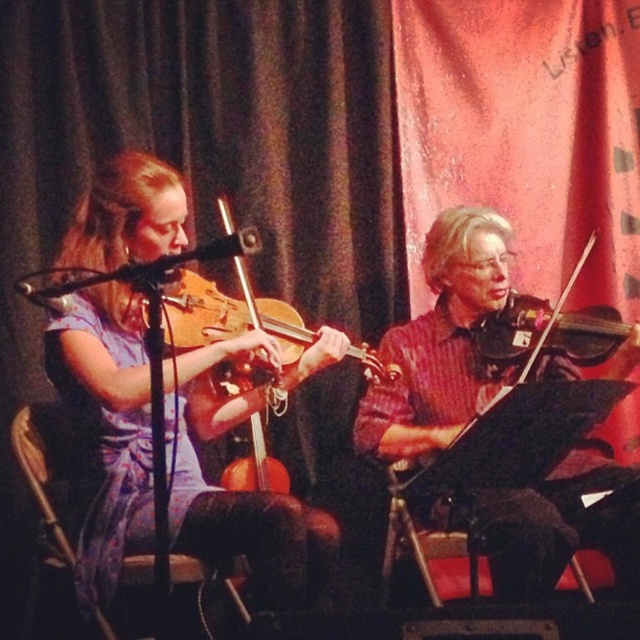
The image size is (640, 640). I want to click on matte black violin at center, so click(x=442, y=342).

Which is in front, point (502, 481) or point (177, 336)?

Positioned in front is point (177, 336).

Between point (480, 280) and point (230, 488), which one is positioned behind?

The point (230, 488) is more distant.

The image size is (640, 640). I want to click on matte black violin at center, so click(442, 342).

This screenshot has width=640, height=640. What do you see at coordinates (248, 492) in the screenshot?
I see `matte wood violin at left` at bounding box center [248, 492].

Is matte wood violin at left bigger than wooden violin at left?

No, matte wood violin at left is not bigger than wooden violin at left.

What are the coordinates of `matte wood violin at left` in the screenshot? It's located at (248, 492).

Who is more distant from viewer, (109,362) or (445,262)?

The point (445,262) is behind.

Is matte wood violin at left to the right of matte black violin at center from the viewer's perspective?

In fact, matte wood violin at left is to the left of matte black violin at center.

Find the location of a particular element. matte wood violin at left is located at coordinates (248, 492).